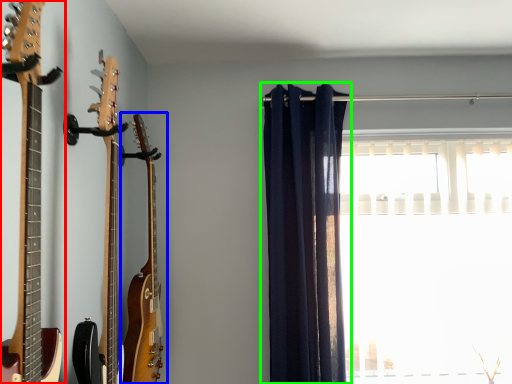
Question: Which is farther away from guitar (highlighted by a red box)? guitar (highlighted by a blue box) or curtain (highlighted by a green box)?

Choices:
 (A) guitar
 (B) curtain

Answer: (B)